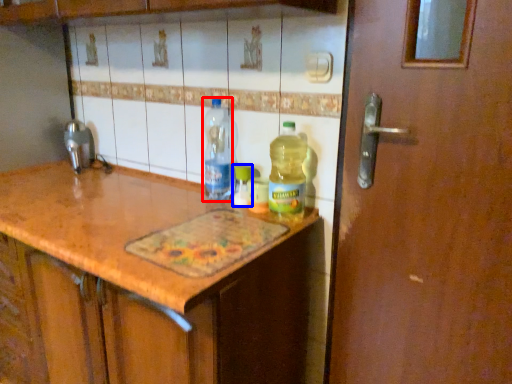
Question: Which object appears closest to the camera in this image, bottle (highlighted by a red box) or bottle (highlighted by a blue box)?

Choices:
 (A) bottle
 (B) bottle

Answer: (A)